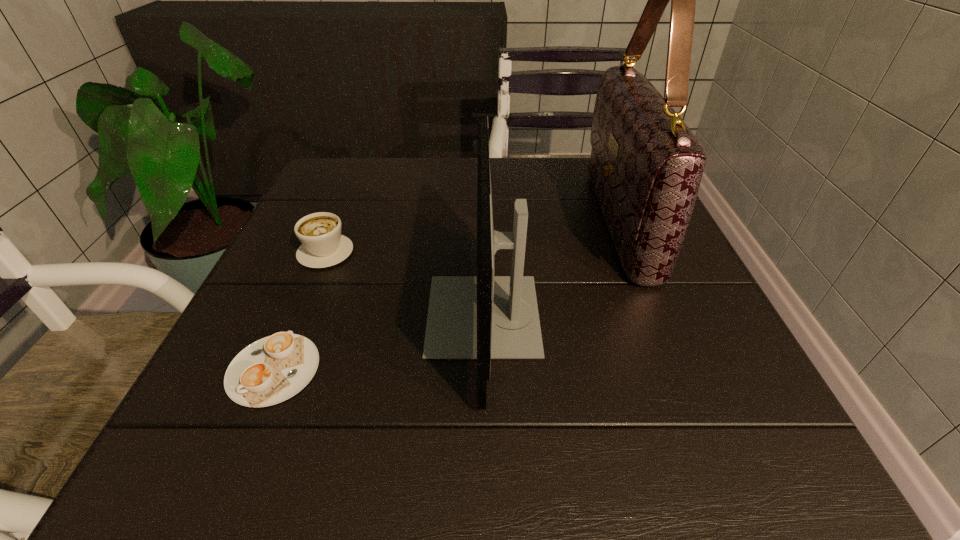
Find the location of `object at the right edge`. object at the right edge is located at coordinates (646, 165).

Identify the location of object present at the far right corner. (646, 165).

Find the location of a particular element. This screenshot has height=540, width=960. vacant area at the far edge is located at coordinates (474, 164).

Find the location of `free space at the near edge`. free space at the near edge is located at coordinates (611, 447).

Find the location of a particular element. vacant space at the left edge of the desktop is located at coordinates tap(367, 220).

Identify the location of vacant space at the right edge of the desktop. (756, 394).

Where is `vacant space at the far left corner`? The height and width of the screenshot is (540, 960). vacant space at the far left corner is located at coordinates (362, 192).

Locate an element on the screen. vacant space at the near right corner of the desktop is located at coordinates (709, 464).

Locate an element on the screen. This screenshot has height=540, width=960. vacant space in between the computer monitor and the second shortest object is located at coordinates (404, 284).

Find the location of a particular element. free space between the rightmost object and the second tallest object is located at coordinates (551, 268).